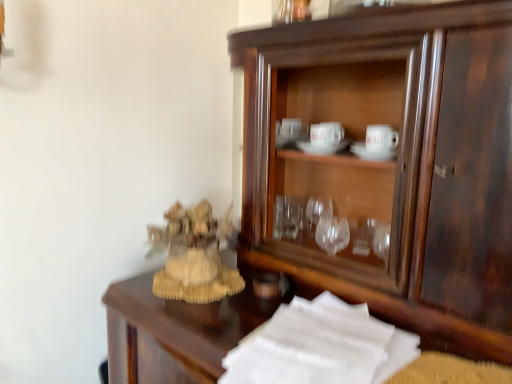
Question: Would you consider beige woven statue at left to be distant from dark wood cupboard at center?

Choices:
 (A) no
 (B) yes

Answer: (A)

Question: Does beige woven statue at left lie behind dark wood cupboard at center?

Choices:
 (A) yes
 (B) no

Answer: (A)

Question: Considering the relative sizes of beige woven statue at left and dark wood cupboard at center in the image provided, is beige woven statue at left thinner than dark wood cupboard at center?

Choices:
 (A) no
 (B) yes

Answer: (B)

Question: Does beige woven statue at left appear on the right side of dark wood cupboard at center?

Choices:
 (A) yes
 (B) no

Answer: (B)

Question: Considering the relative sizes of beige woven statue at left and dark wood cupboard at center in the image provided, is beige woven statue at left shorter than dark wood cupboard at center?

Choices:
 (A) no
 (B) yes

Answer: (B)

Question: Does point (351, 354) appear closer or farther from the camera than point (309, 48)?

Choices:
 (A) closer
 (B) farther

Answer: (A)

Question: From the image's perspective, is white paper at lower right located above or below dark wood cupboard at center?

Choices:
 (A) below
 (B) above

Answer: (A)

Question: Is white paper at lower right wider or thinner than dark wood cupboard at center?

Choices:
 (A) wide
 (B) thin

Answer: (A)

Question: From a real-world perspective, is white paper at lower right positioned above or below dark wood cupboard at center?

Choices:
 (A) below
 (B) above

Answer: (A)

Question: Is dark wood cupboard at center inside the boundaries of beige woven statue at left, or outside?

Choices:
 (A) inside
 (B) outside

Answer: (B)

Question: Considering the relative positions of dark wood cupboard at center and beige woven statue at left in the image provided, is dark wood cupboard at center to the left or to the right of beige woven statue at left?

Choices:
 (A) left
 (B) right

Answer: (B)

Question: Is dark wood cupboard at center in front of or behind beige woven statue at left in the image?

Choices:
 (A) front
 (B) behind

Answer: (A)

Question: Looking at the image, does dark wood cupboard at center seem bigger or smaller compared to beige woven statue at left?

Choices:
 (A) small
 (B) big

Answer: (B)

Question: Is beige woven statue at left wider or thinner than white paper at lower right?

Choices:
 (A) thin
 (B) wide

Answer: (A)

Question: From a real-world perspective, is beige woven statue at left physically located above or below white paper at lower right?

Choices:
 (A) above
 (B) below

Answer: (A)